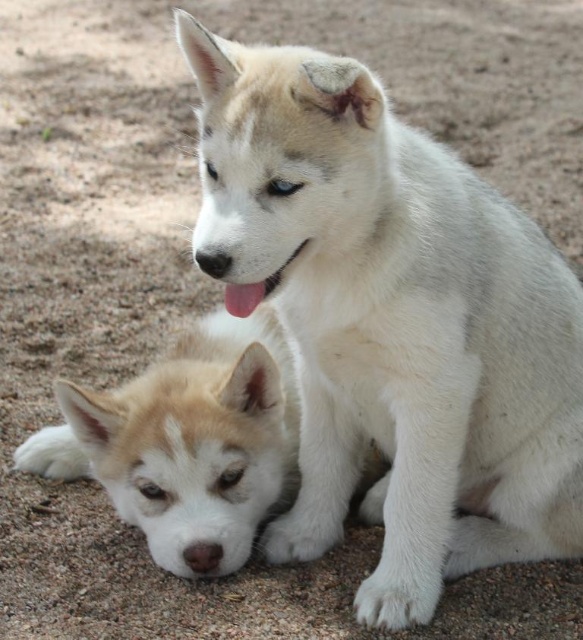
Is white fur dog at center positioned before fuzzy white puppy at lower left?

That is True.

Can you confirm if white fur dog at center is smaller than fuzzy white puppy at lower left?

No, white fur dog at center is not smaller than fuzzy white puppy at lower left.

Describe the element at coordinates (391, 321) in the screenshot. This screenshot has height=640, width=583. I see `white fur dog at center` at that location.

The height and width of the screenshot is (640, 583). I want to click on white fur dog at center, so (x=391, y=321).